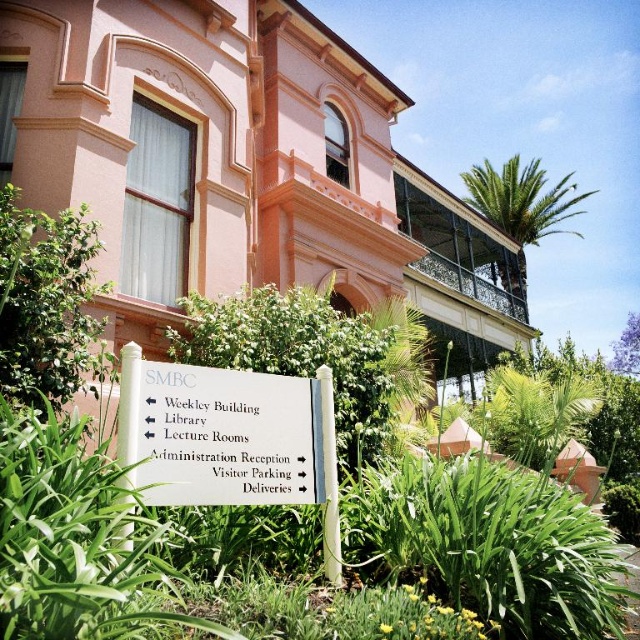
Question: Can you confirm if pink matte building at center is positioned to the right of white plastic sign at center?

Choices:
 (A) no
 (B) yes

Answer: (B)

Question: Does pink matte building at center appear on the left side of white plastic sign at center?

Choices:
 (A) yes
 (B) no

Answer: (B)

Question: Among these points, which one is nearest to the camera?

Choices:
 (A) (289, 256)
 (B) (200, 436)

Answer: (B)

Question: Which point is closer to the camera?

Choices:
 (A) white plastic sign at center
 (B) pink matte building at center

Answer: (A)

Question: Where is pink matte building at center located in relation to white plastic sign at center in the image?

Choices:
 (A) right
 (B) left

Answer: (A)

Question: Which of the following is the closest to the observer?

Choices:
 (A) (243, 460)
 (B) (161, 324)

Answer: (A)